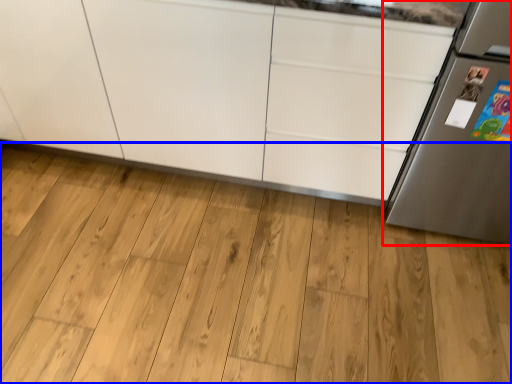
Question: Among these objects, which one is nearest to the camera, refrigerator (highlighted by a red box) or hardwood (highlighted by a blue box)?

Choices:
 (A) refrigerator
 (B) hardwood

Answer: (A)